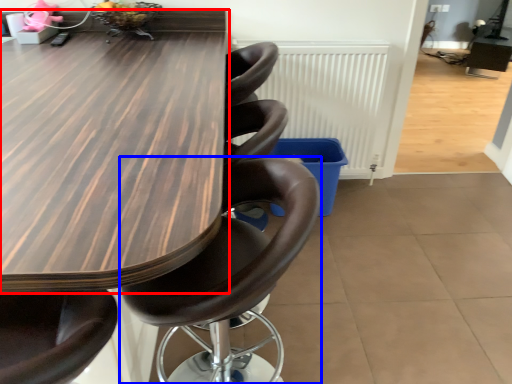
Question: Which object is further to the camera taking this photo, table (highlighted by a red box) or chair (highlighted by a blue box)?

Choices:
 (A) table
 (B) chair

Answer: (B)